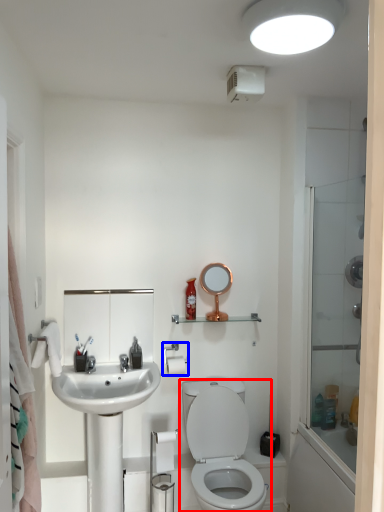
Question: Among these objects, which one is nearest to the camera, toilet (highlighted by a red box) or toilet paper (highlighted by a blue box)?

Choices:
 (A) toilet
 (B) toilet paper

Answer: (A)